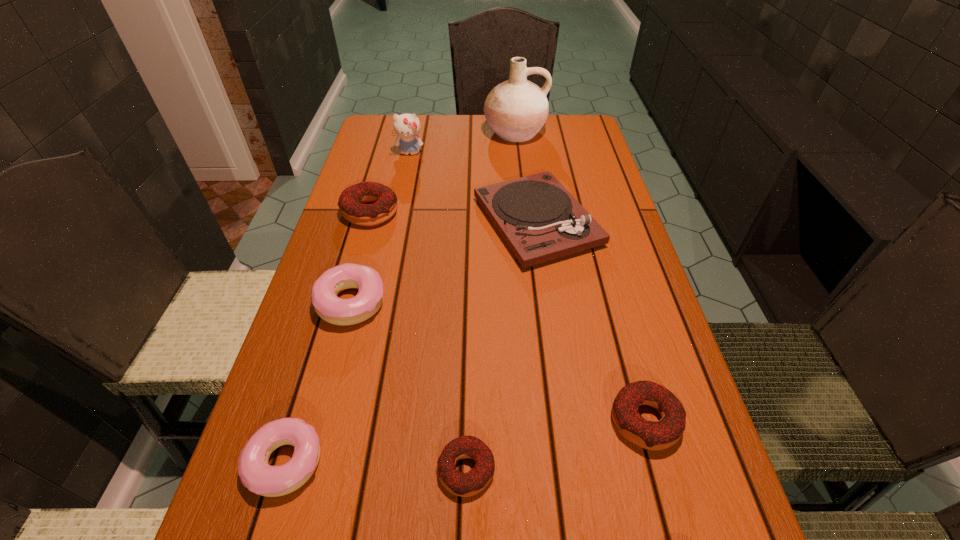
Identify the location of free location at the left edge. The width and height of the screenshot is (960, 540). (301, 501).

At what (x,y) coordinates should I click in order to perform the action: click on vacant space at the right edge of the desktop. Please return your answer as a coordinate pair (x, y). The width and height of the screenshot is (960, 540). Looking at the image, I should click on (614, 234).

At what (x,y) coordinates should I click in order to perform the action: click on vacant space at the far left corner of the desktop. Please return your answer as a coordinate pair (x, y). Looking at the image, I should click on (365, 145).

Identify the location of vacant space at the far right corner of the desktop. The image size is (960, 540). (551, 125).

Locate an element on the screen. free space that is in between the phonograph_record and the leftmost chocolate doughnut is located at coordinates (453, 217).

The image size is (960, 540). I want to click on empty space that is in between the farther pink doughnut and the farthest doughnut, so click(x=361, y=257).

Identify the location of vacant area that lies between the second doughnut from right to left and the tallest object. (491, 301).

Identify the location of empty location between the phonograph_record and the rightmost doughnut. (591, 321).

Where is `unoccupied area between the shortest doughnut and the biggest chocolate doughnut`? The height and width of the screenshot is (540, 960). unoccupied area between the shortest doughnut and the biggest chocolate doughnut is located at coordinates (418, 341).

Image resolution: width=960 pixels, height=540 pixels. Identify the location of free space between the biggest chocolate doughnut and the phonograph_record. (453, 217).